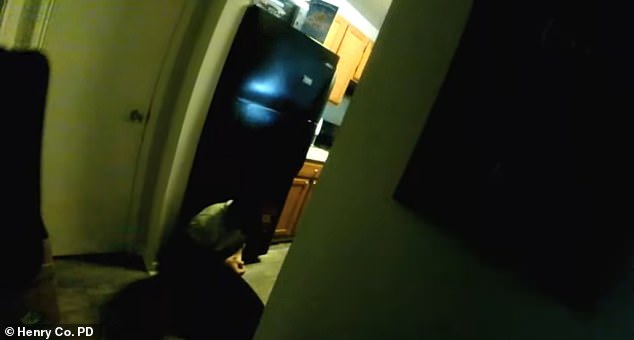
What are the coordinates of `ceiling` in the screenshot? It's located at (366, 8).